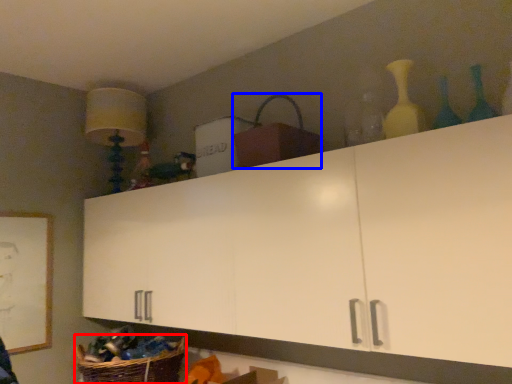
Question: Among these objects, which one is farthest to the camera, basket (highlighted by a red box) or basket (highlighted by a blue box)?

Choices:
 (A) basket
 (B) basket

Answer: (A)